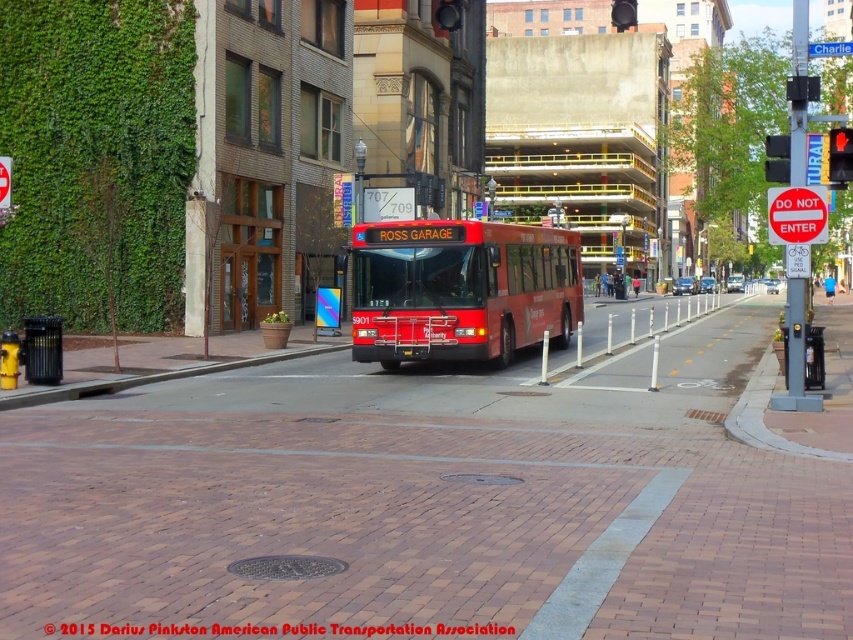
Question: Which of these objects is positioned closest to the red matte bus at center?

Choices:
 (A) brick at center
 (B) red glass traffic light at upper right
 (C) blue metallic street sign at upper center

Answer: (A)

Question: Can you confirm if metallic black traffic light at upper right is positioned below blue metallic street sign at upper center?

Choices:
 (A) yes
 (B) no

Answer: (A)

Question: Is red glass traffic light at upper right thinner than metallic black traffic light at upper right?

Choices:
 (A) no
 (B) yes

Answer: (B)

Question: Is brick pavement at center to the left of brick at center from the viewer's perspective?

Choices:
 (A) no
 (B) yes

Answer: (A)

Question: Which point is closer to the camera taking this photo?

Choices:
 (A) (552, 276)
 (B) (833, 144)
 (C) (849, 49)

Answer: (C)

Question: Which object is the farthest from the metallic black traffic light at upper right?

Choices:
 (A) red matte bus at center
 (B) brick pavement at center
 (C) brick at center
 (D) red glass traffic light at upper right

Answer: (C)